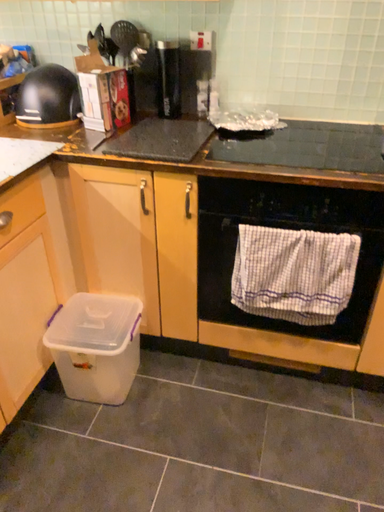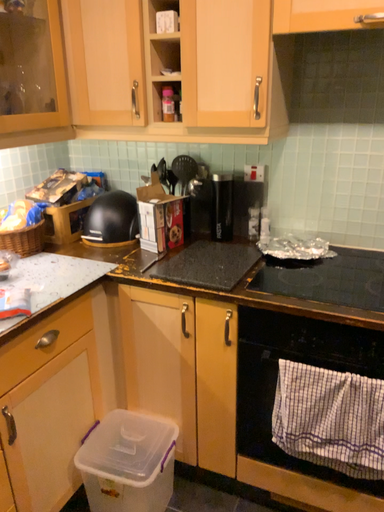
Question: How did the camera likely rotate when shooting the video?

Choices:
 (A) rotated downward
 (B) rotated upward

Answer: (B)